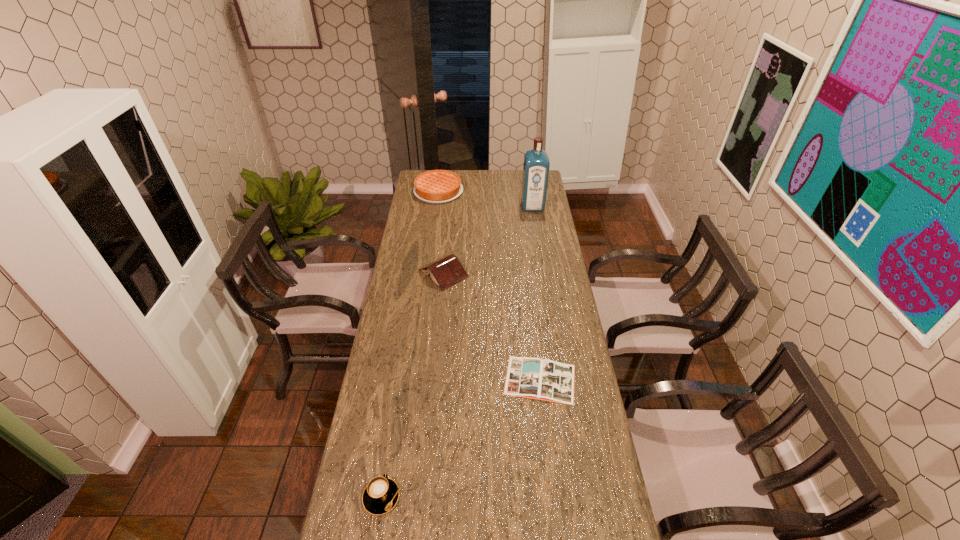
In order to click on the tallest object in this screenshot , I will do `click(536, 166)`.

Locate an element on the screen. The width and height of the screenshot is (960, 540). pie is located at coordinates pyautogui.click(x=436, y=186).

You are a GUI agent. You are given a task and a screenshot of the screen. Output one action in this format:
    pyautogui.click(x=<x>, y=<y>)
    Task: Click on the leftmost book
    
    Given the screenshot: What is the action you would take?
    pyautogui.click(x=446, y=271)

Locate an element on the screen. the farthest book is located at coordinates (446, 271).

You are a GUI agent. You are given a task and a screenshot of the screen. Output one action in this format:
    pyautogui.click(x=<x>, y=<y>)
    Task: Click on the cappuccino
    The image size is (960, 540).
    Given the screenshot: What is the action you would take?
    pyautogui.click(x=380, y=496)

Where is `the shortest book`? This screenshot has width=960, height=540. the shortest book is located at coordinates (548, 380).

This screenshot has height=540, width=960. Find the location of `the second farthest book`. the second farthest book is located at coordinates (548, 380).

At what (x,y) coordinates should I click in order to perform the action: click on free space located 0.270m on the flat label side of the liquor. Please return your answer as a coordinate pair (x, y). Looking at the image, I should click on (539, 245).

Where is `vacant space located 0.220m on the front of the pie`? This screenshot has width=960, height=540. vacant space located 0.220m on the front of the pie is located at coordinates pyautogui.click(x=433, y=229).

Where is `free space located on the back of the tallest book`? free space located on the back of the tallest book is located at coordinates (448, 222).